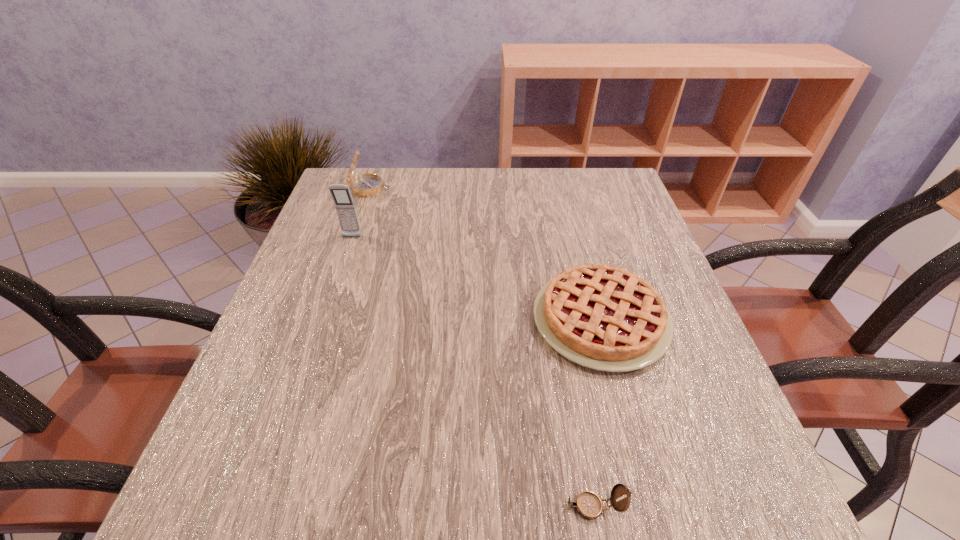
Find the location of a particular element. The height and width of the screenshot is (540, 960). free space that satisfies the following two spatial constraints: 1. on the front-facing side of the pie; 2. on the right side of the second farthest object is located at coordinates (324, 320).